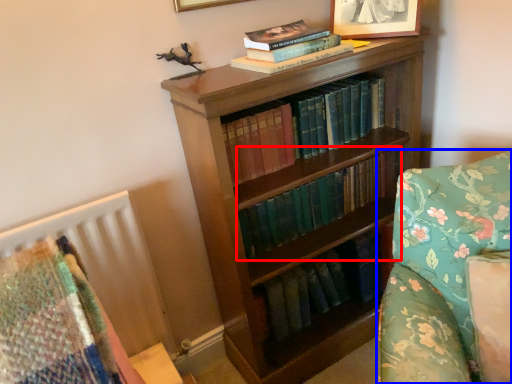
Question: Among these objects, which one is nearest to the camera, book (highlighted by a red box) or furniture (highlighted by a blue box)?

Choices:
 (A) book
 (B) furniture

Answer: (B)